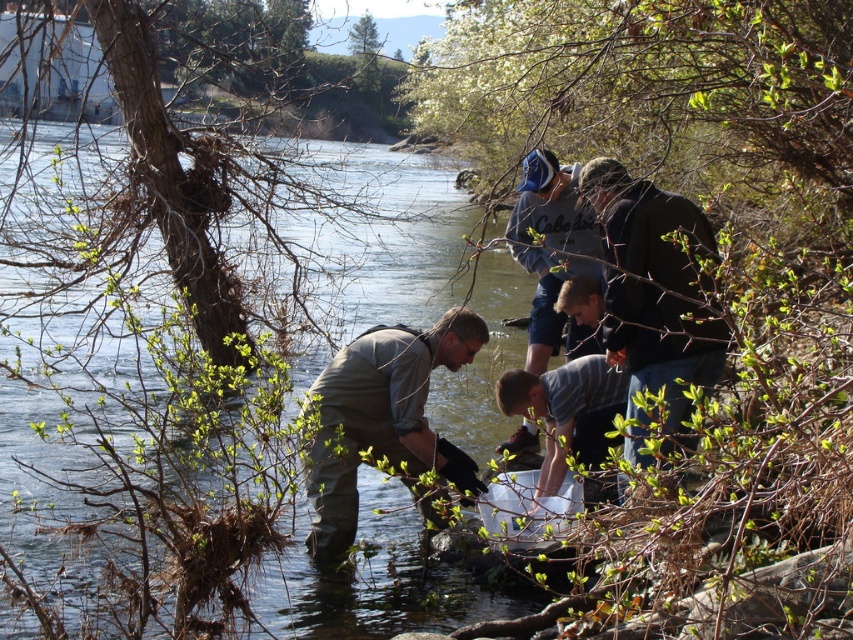
Between dark brown leather jacket at upper right and striped cotton shirt at center, which one appears on the right side from the viewer's perspective?

Positioned to the right is dark brown leather jacket at upper right.

The width and height of the screenshot is (853, 640). I want to click on dark brown leather jacket at upper right, so [x=654, y=288].

Does dark brown leather jacket at upper right have a greater width compared to blue fabric cap at upper center?

Indeed, dark brown leather jacket at upper right has a greater width compared to blue fabric cap at upper center.

Is dark brown leather jacket at upper right further to camera compared to blue fabric cap at upper center?

No, it is not.

Is point (668, 355) behind point (520, 262)?

No, it is not.

This screenshot has width=853, height=640. I want to click on dark brown leather jacket at upper right, so click(x=654, y=288).

Who is lower down, matte gray shirt at center or blue fabric cap at upper center?

matte gray shirt at center is lower down.

Can you confirm if matte gray shirt at center is thinner than blue fabric cap at upper center?

No, matte gray shirt at center is not thinner than blue fabric cap at upper center.

Is point (351, 412) farther from viewer compared to point (567, 180)?

No, (351, 412) is in front of (567, 180).

Identify the location of matte gray shirt at center. Image resolution: width=853 pixels, height=640 pixels. (383, 419).